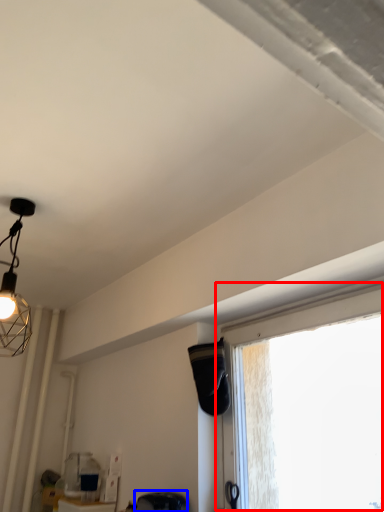
Question: Which point is closer to the camera, window (highlighted by a red box) or swivel chair (highlighted by a blue box)?

Choices:
 (A) window
 (B) swivel chair

Answer: (A)